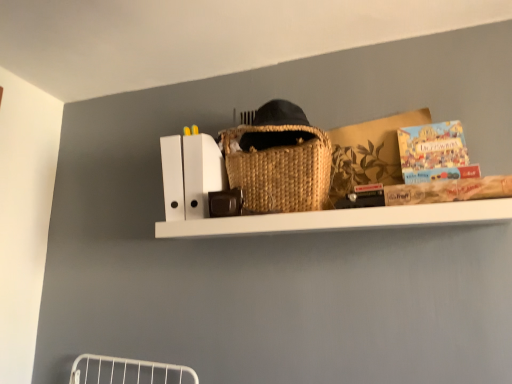
The width and height of the screenshot is (512, 384). What are the coordinates of `multicolored cardboard book at upper right` in the screenshot? It's located at (434, 153).

What do you see at coordinates (434, 153) in the screenshot? I see `multicolored cardboard book at upper right` at bounding box center [434, 153].

In order to face multicolored cardboard book at upper right, should I rotate leftwards or rightwards?

Rotate right and turn 23.295 degrees.

Find the location of a particular element. multicolored cardboard book at upper right is located at coordinates (434, 153).